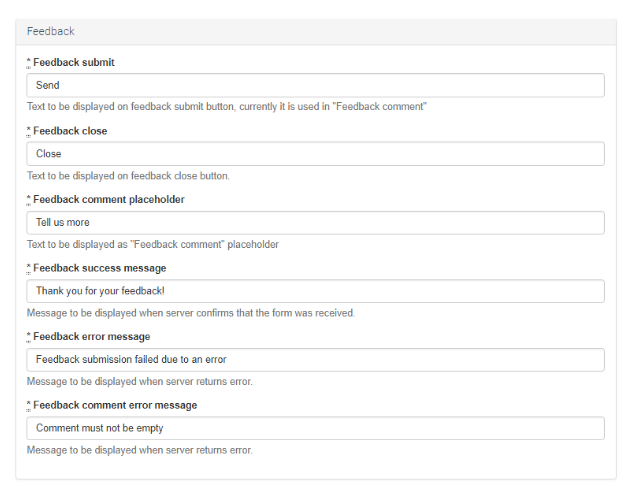
What are the coordinates of `bar 4` in the screenshot? It's located at (389, 363).